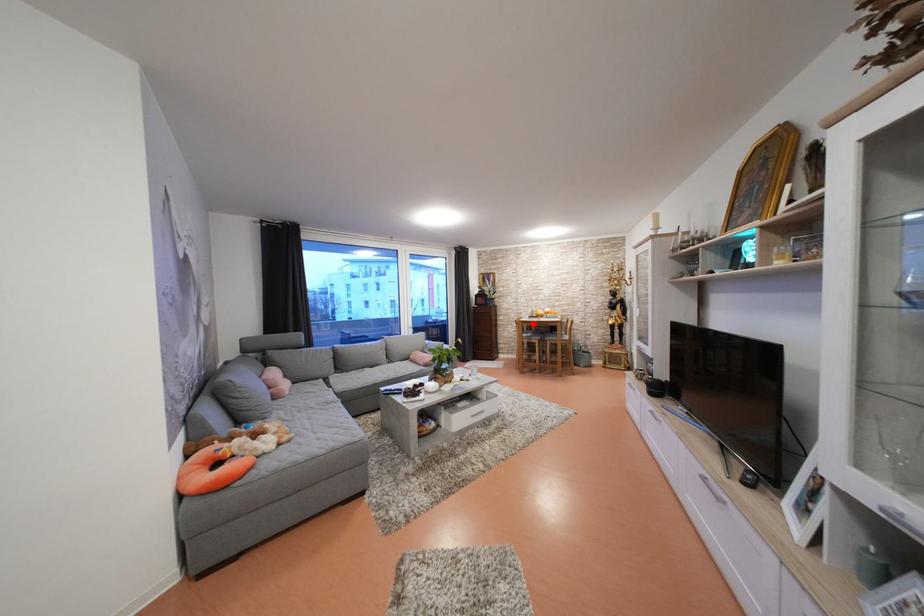
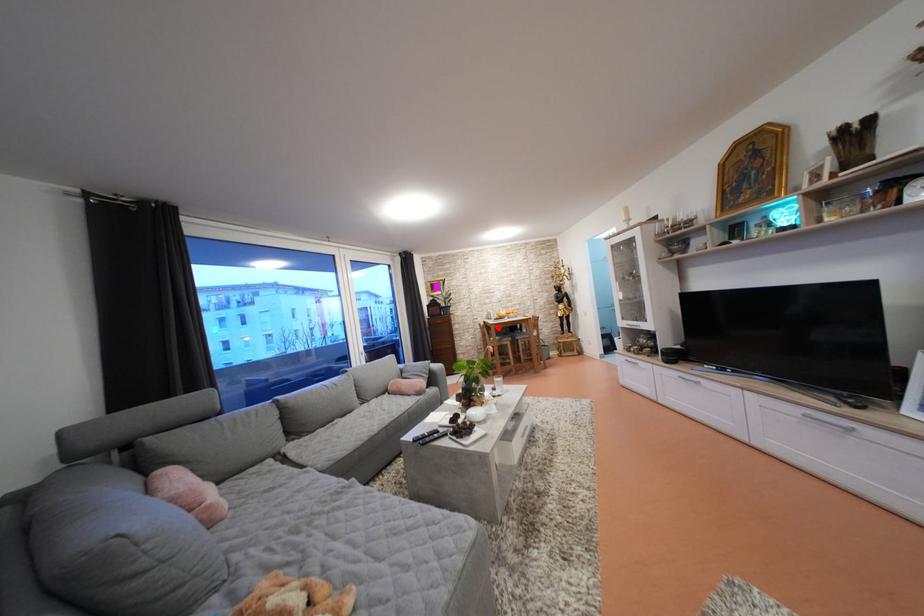
I am providing you with two images of the same scene from different viewpoints. A red point is marked on the first image and another point is marked on the second image. Is the red point in image1 aligned with the point shown in image2?

Yes